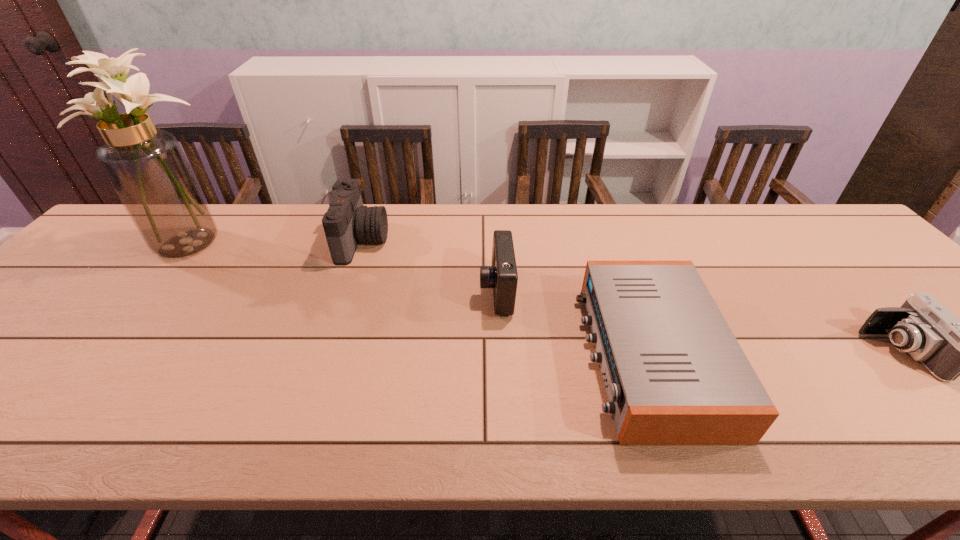
The height and width of the screenshot is (540, 960). I want to click on the tallest object, so click(x=146, y=166).

Find the location of a particular element. This screenshot has width=960, height=540. flower arrangement is located at coordinates (146, 166).

The image size is (960, 540). I want to click on the farthest camera, so click(347, 221).

Locate an element on the screen. This screenshot has height=540, width=960. the fourth object from right to left is located at coordinates (347, 221).

You are a GUI agent. You are given a task and a screenshot of the screen. Output one action in this format:
    pyautogui.click(x=<x>, y=<y>)
    Task: Click on the third object from left to right
    The height and width of the screenshot is (540, 960).
    Given the screenshot: What is the action you would take?
    pyautogui.click(x=502, y=276)

Identify the location of the second nearest camera. (502, 276).

Locate an element on the screen. This screenshot has height=540, width=960. the nearest camera is located at coordinates (948, 347).

Identify the location of the shortest camera. (948, 347).

I want to click on the second object from right to left, so click(x=675, y=374).

Image resolution: width=960 pixels, height=540 pixels. Identify the location of vacant space located 0.370m on the front of the tallest object. (87, 374).